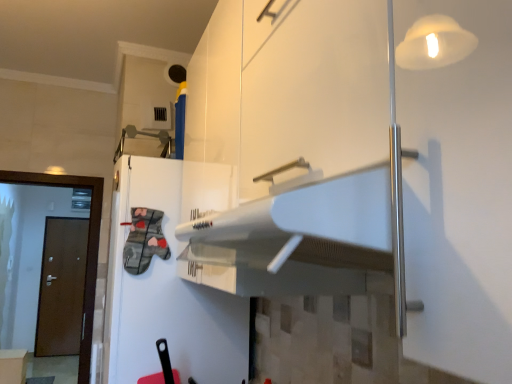
Image resolution: width=512 pixels, height=384 pixels. I want to click on vacant region above brown wooden door at left, the 1th door viewed from the right (from a real-world perspective), so click(45, 167).